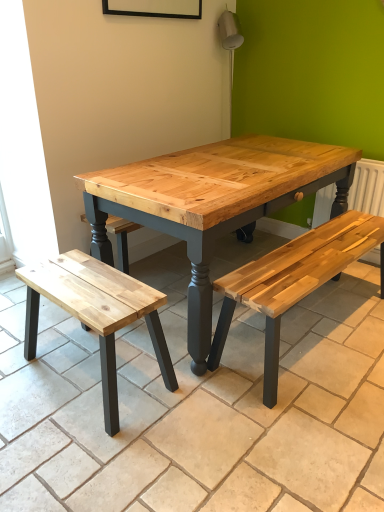
This screenshot has height=512, width=384. What are the coordinates of `free point above natural wood bench at lower left (from a real-world perspective)` in the screenshot? It's located at (90, 284).